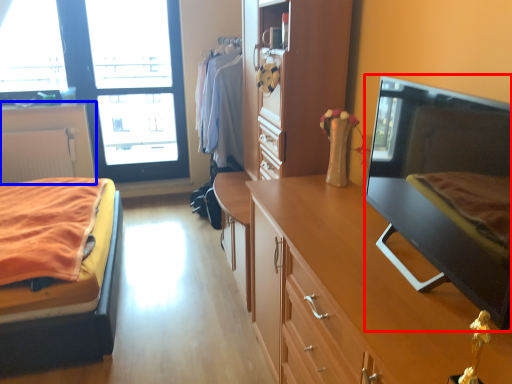
Question: Which of the following is the farthest to the observer, flat (highlighted by a red box) or cabinetry (highlighted by a blue box)?

Choices:
 (A) flat
 (B) cabinetry

Answer: (B)